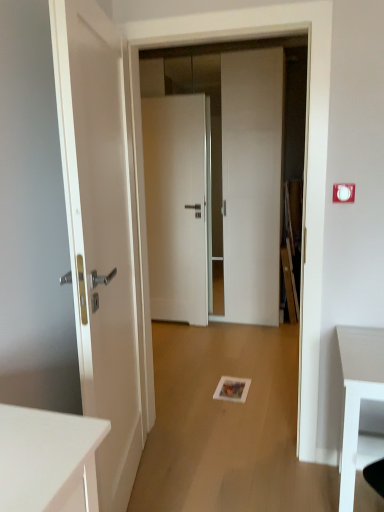
Find the location of `vacant space underneath white matte door at center, which is counted as the first door, starting from the back (from a real-world perspective)`. vacant space underneath white matte door at center, which is counted as the first door, starting from the back (from a real-world perspective) is located at coordinates (173, 324).